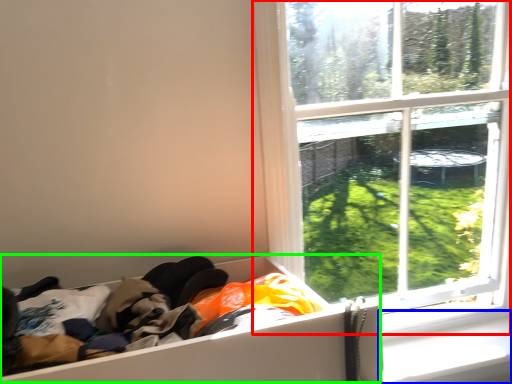
Question: Which object is positioned farthest from window (highlighted by a red box)? Select from window sill (highlighted by a blue box) and storage box (highlighted by a green box).

Choices:
 (A) window sill
 (B) storage box

Answer: (B)